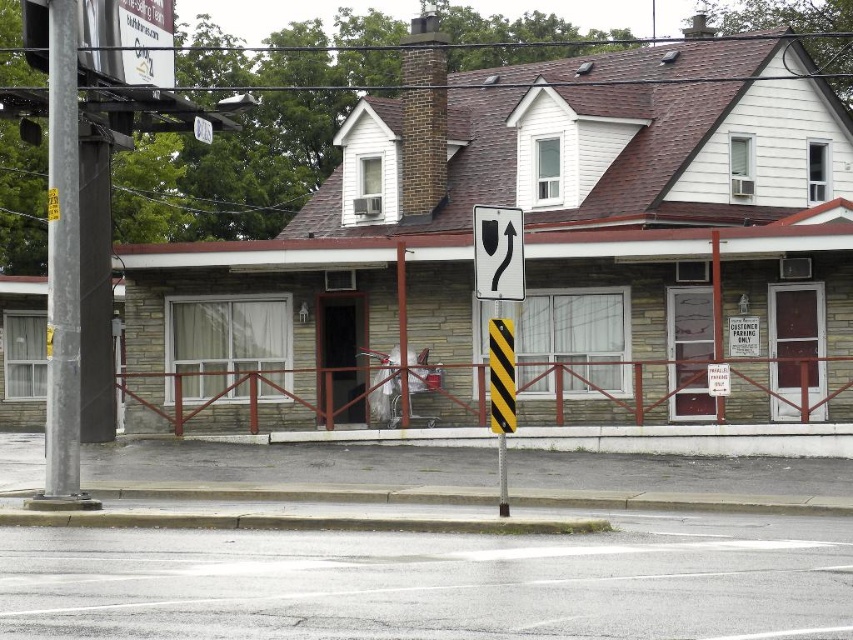
You are a delivery driver approaching this building and need to park your truck, which is 50 feet long. There is a space between the metallic gray pole at left and the building. Can you fit your truck there?

The metallic gray pole at left is 52.79 feet from the camera. Since your truck is 50 feet long, you can fit your truck in the space between the metallic gray pole at left and the building.

You are a delivery driver approaching the crosswalk at the bottom of the frame. You need to stop your truck, which is 6 meters long, between the asphalt at lower center and the metallic gray pole at left. Is there enough space for your truck to fit entirely between them?

The distance between the asphalt at lower center and the metallic gray pole at left is 7.31 meters. Since the truck is 6 meters long, it can fit entirely between them as 7.31 meters is greater than 6 meters.